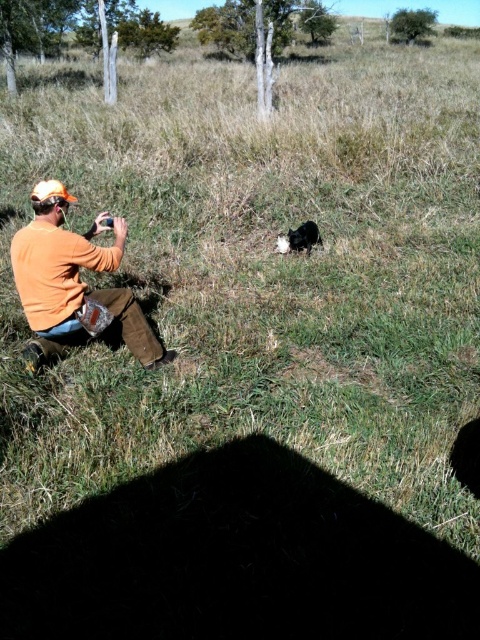
You are a fashion designer analyzing the image. You need to determine which clothing item is wider between the orange cotton shirt at left and the black fur dog at center. Which one is wider?

The orange cotton shirt at left is wider than the black fur dog at center according to the description.

You are a fashion designer observing the scene. You need to determine which item is bigger between the orange cotton shirt at left and the black fur dog at center. Which one is larger?

The orange cotton shirt at left is larger in size than the black fur dog at center.

You are a photographer trying to capture the black fur dog at center in your shot. The orange cotton shirt at left is blocking your view. Can you move the shirt to the side to get a clear shot of the dog?

The orange cotton shirt at left is positioned under the black fur dog at center, so moving the shirt would not obstruct the dog since it is already below it.